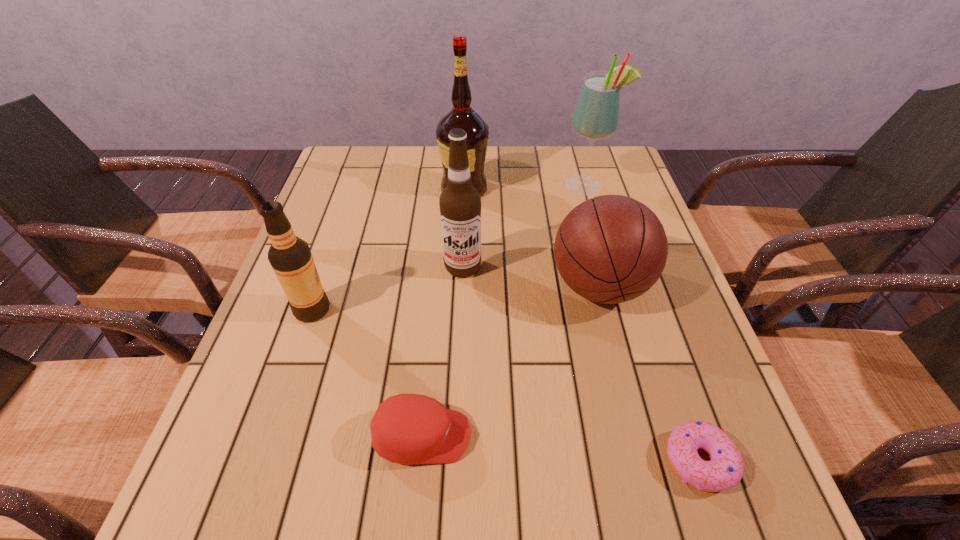
Find the location of a particular element. the rightmost alcohol is located at coordinates (596, 115).

Find the location of a particular element. the second nearest alcohol is located at coordinates (460, 203).

Where is `the shortest alcohol`? the shortest alcohol is located at coordinates (290, 257).

You are a GUI agent. You are given a task and a screenshot of the screen. Output one action in this format:
    pyautogui.click(x=<x>, y=<y>)
    Task: Click on the fourth tallest object
    The width and height of the screenshot is (960, 540).
    Given the screenshot: What is the action you would take?
    pyautogui.click(x=290, y=257)

Find the location of a particular element. basketball is located at coordinates (610, 249).

Where is `the second shortest object`? The width and height of the screenshot is (960, 540). the second shortest object is located at coordinates (407, 429).

Identify the location of the shortest object. (725, 469).

Find the location of a particular element. vacant space located on the left of the rightmost alcohol is located at coordinates (520, 186).

Locate an element on the screen. This screenshot has height=540, width=960. free space located 0.090m on the label of the third farthest alcohol is located at coordinates (461, 310).

Image resolution: width=960 pixels, height=540 pixels. I want to click on free space located on the label of the nearest alcohol, so coord(358,309).